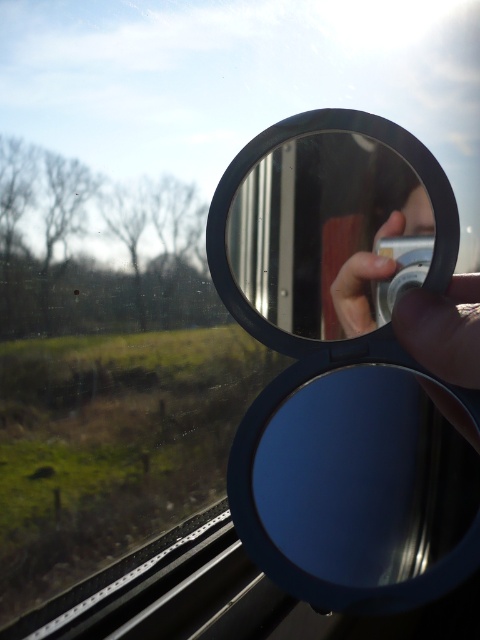
Question: Which of the following is the closest to the observer?

Choices:
 (A) blue metallic magnifying glass at center
 (B) blue matte view mirror at center
 (C) black metallic mirror at center

Answer: (A)

Question: Which object is positioned farthest from the blue matte view mirror at center?

Choices:
 (A) blue metallic magnifying glass at center
 (B) black metallic mirror at center

Answer: (B)

Question: Can you confirm if blue metallic magnifying glass at center is wider than black metallic mirror at center?

Choices:
 (A) no
 (B) yes

Answer: (B)

Question: Considering the relative positions of blue matte view mirror at center and black metallic mirror at center in the image provided, where is blue matte view mirror at center located with respect to black metallic mirror at center?

Choices:
 (A) left
 (B) right

Answer: (B)

Question: Which of these objects is positioned farthest from the blue matte view mirror at center?

Choices:
 (A) blue metallic magnifying glass at center
 (B) black metallic mirror at center

Answer: (B)

Question: Is blue metallic magnifying glass at center below black metallic mirror at center?

Choices:
 (A) no
 (B) yes

Answer: (B)